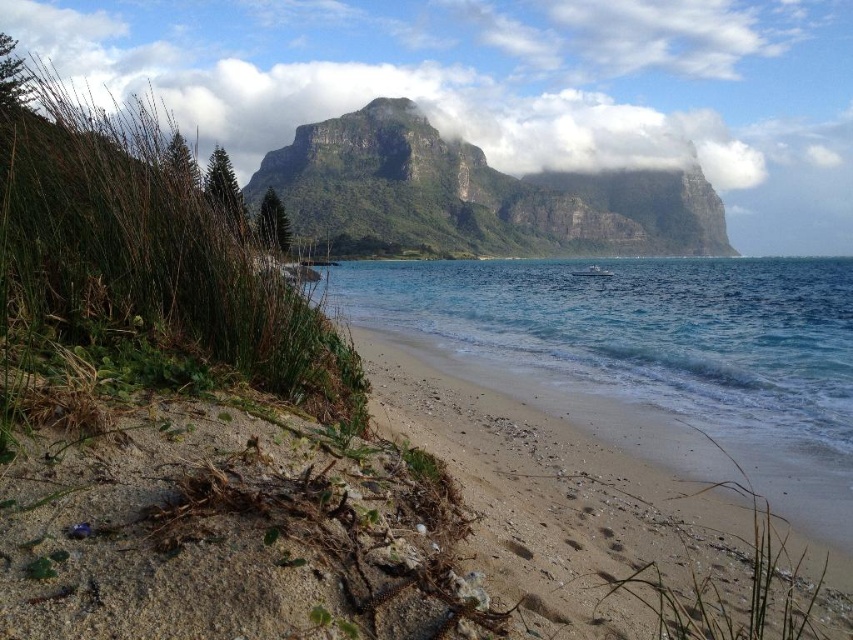
Question: Where is white fluffy cloud at upper center located in relation to rugged stone mountain at center in the image?

Choices:
 (A) above
 (B) below

Answer: (A)

Question: Among these objects, which one is nearest to the camera?

Choices:
 (A) rugged stone mountain at center
 (B) clear blue water at center
 (C) white fluffy cloud at upper center

Answer: (B)

Question: Among these points, which one is farthest from the camera?

Choices:
 (A) pyautogui.click(x=505, y=202)
 (B) pyautogui.click(x=497, y=36)

Answer: (B)

Question: Which point appears farthest from the camera in this image?

Choices:
 (A) (753, 387)
 (B) (294, 195)
 (C) (811, 35)
 (D) (648, 529)

Answer: (C)

Question: From the image, what is the correct spatial relationship of clear blue water at center in relation to light brown sandy beach at center?

Choices:
 (A) left
 (B) right

Answer: (B)

Question: Is white fluffy cloud at upper center bigger than light brown sandy beach at center?

Choices:
 (A) no
 (B) yes

Answer: (B)